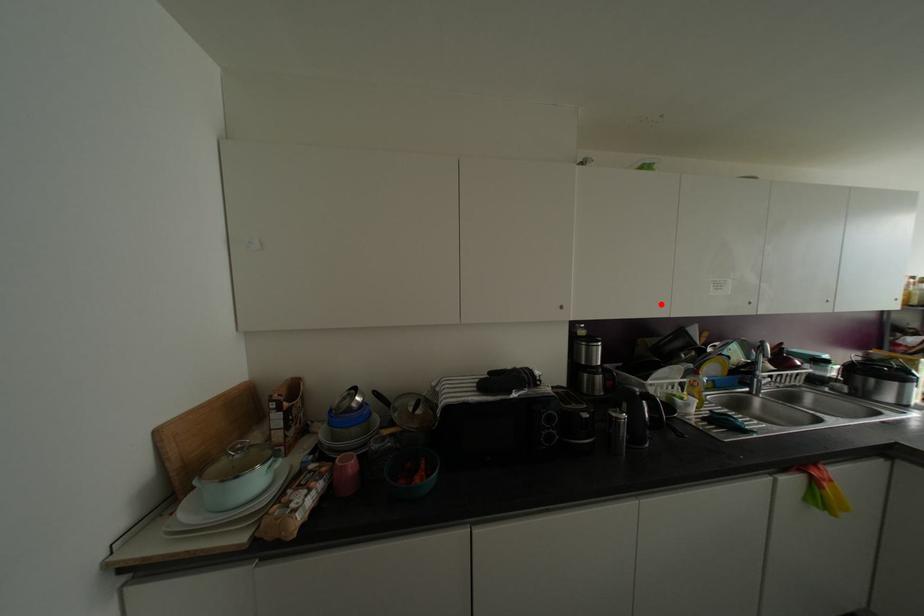
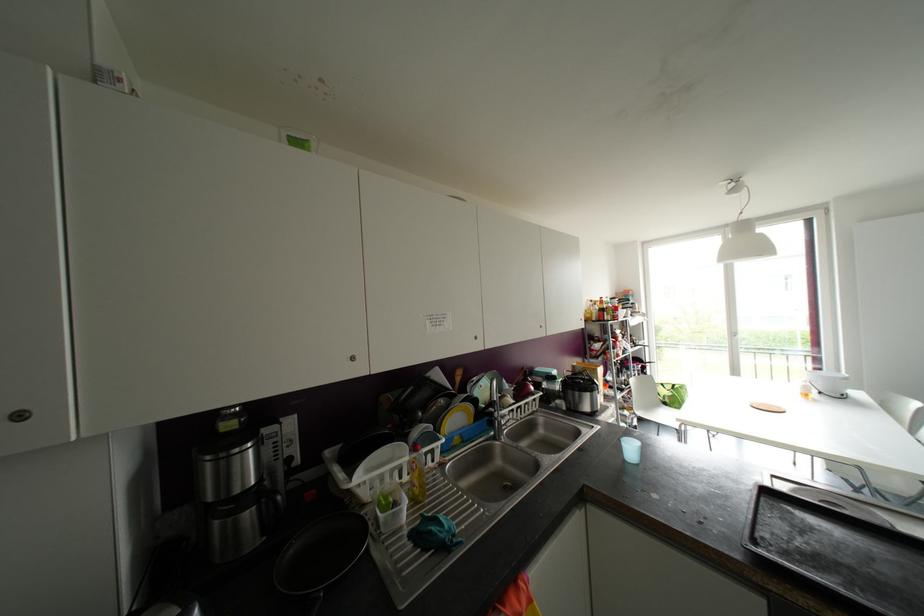
Question: I am providing you with two images of the same scene from different viewpoints. Given a red point in image1, look at the same physical point in image2. Is it:

Choices:
 (A) Closer to the viewpoint
 (B) Farther from the viewpoint

Answer: (B)